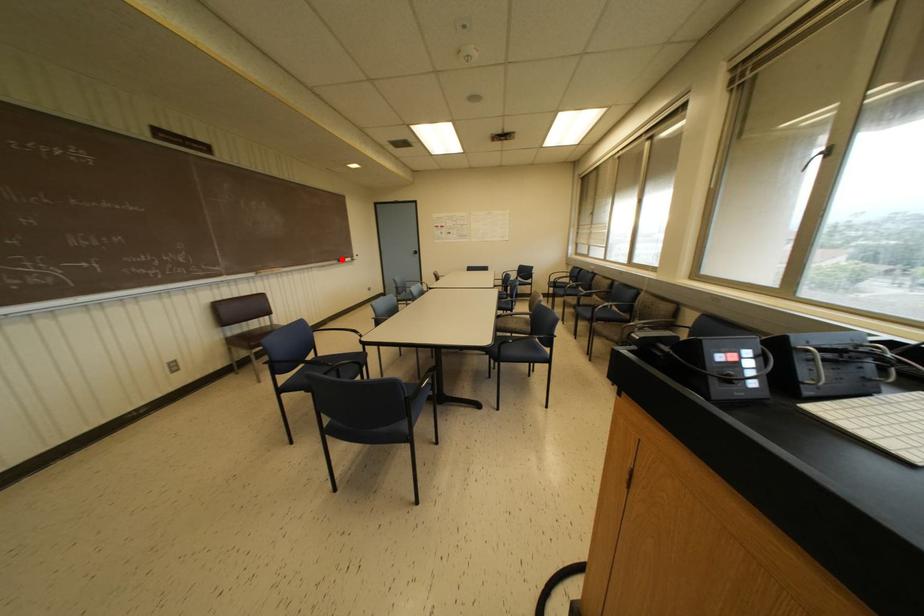
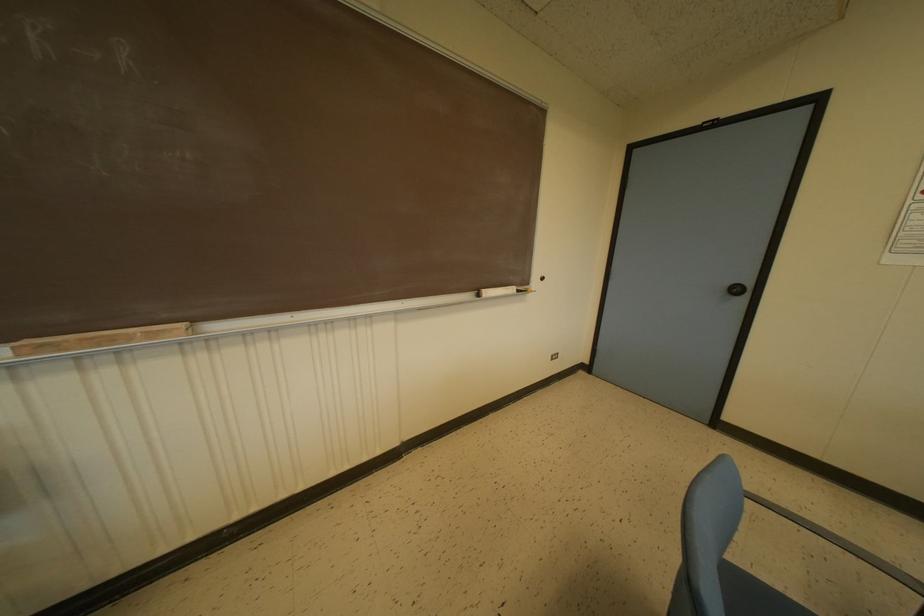
The point at the highlighted location is marked in the first image. Where is the corresponding point in the second image?

(487, 292)